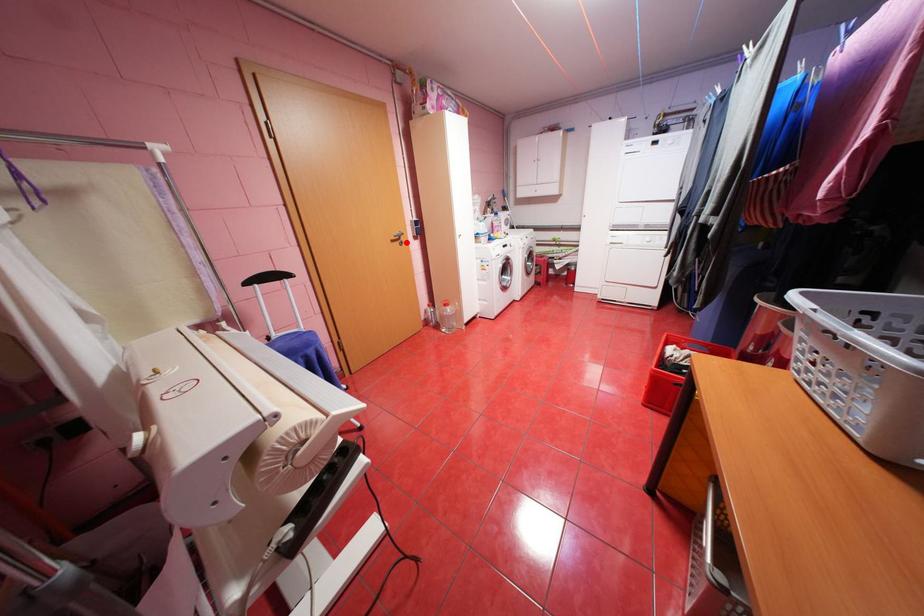
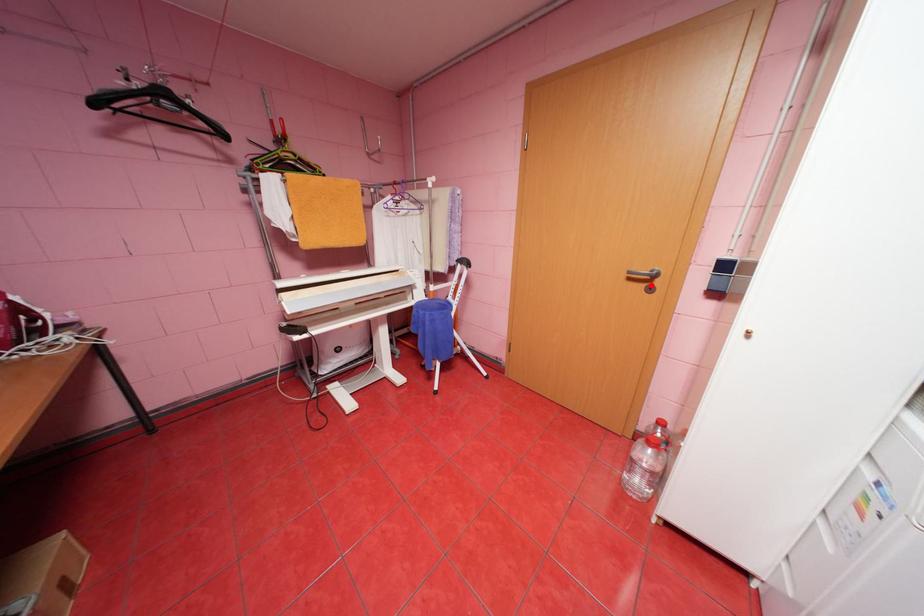
I am providing you with two images of the same scene from different viewpoints. A red point is marked on the first image and another point is marked on the second image. Are the points marked in image1 and image2 representing the same 3D position?

Yes